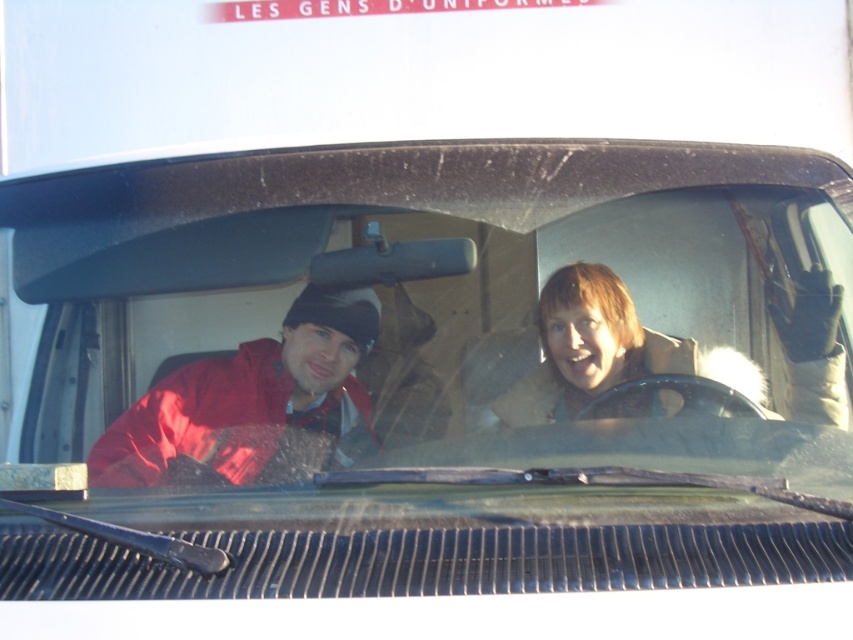
You are a delivery person who needs to hand a package to the driver. The package is too large to fit through the open sunroof. Can you see the matte red jacket at left clearly through the transparent glass windshield at center?

The transparent glass windshield at center is much taller than the matte red jacket at left, so the matte red jacket at left is likely positioned lower and may be partially obscured by the windshield, making it difficult to see clearly through the transparent glass windshield at center.

You are a delivery robot approaching the vehicle. You need to determine if you can see the matte red jacket at left clearly through the transparent glass windshield at center. The minimum distance required for clear visibility is 5 inches. Can you see it clearly?

A: The transparent glass windshield at center is only 4.43 inches away from the matte red jacket at left, which is less than the required 5 inches for clear visibility. Therefore, the delivery robot cannot see the matte red jacket at left clearly through the transparent glass windshield at center.